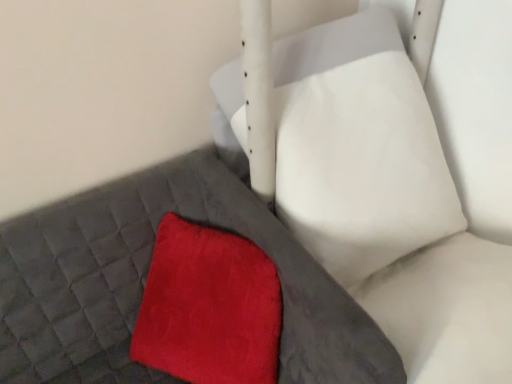
Question: Considering the relative sizes of velvety red throw pillow at center and matte gray bed frame at lower left in the image provided, is velvety red throw pillow at center bigger than matte gray bed frame at lower left?

Choices:
 (A) no
 (B) yes

Answer: (A)

Question: Could you tell me if velvety red throw pillow at center is turned towards matte gray bed frame at lower left?

Choices:
 (A) no
 (B) yes

Answer: (B)

Question: Can you confirm if velvety red throw pillow at center is taller than matte gray bed frame at lower left?

Choices:
 (A) yes
 (B) no

Answer: (B)

Question: Does velvety red throw pillow at center come behind matte gray bed frame at lower left?

Choices:
 (A) yes
 (B) no

Answer: (A)

Question: Does velvety red throw pillow at center have a greater width compared to matte gray bed frame at lower left?

Choices:
 (A) yes
 (B) no

Answer: (B)

Question: Is velvety red throw pillow at center in contact with matte gray bed frame at lower left?

Choices:
 (A) no
 (B) yes

Answer: (A)

Question: Is velvet red cushion at center located outside matte gray bed frame at lower left?

Choices:
 (A) no
 (B) yes

Answer: (B)

Question: Does velvet red cushion at center contain matte gray bed frame at lower left?

Choices:
 (A) yes
 (B) no

Answer: (B)

Question: Is velvet red cushion at center further to the viewer compared to matte gray bed frame at lower left?

Choices:
 (A) no
 (B) yes

Answer: (A)

Question: From the image's perspective, is velvet red cushion at center located beneath matte gray bed frame at lower left?

Choices:
 (A) no
 (B) yes

Answer: (A)

Question: Considering the relative sizes of velvet red cushion at center and matte gray bed frame at lower left in the image provided, is velvet red cushion at center thinner than matte gray bed frame at lower left?

Choices:
 (A) yes
 (B) no

Answer: (B)

Question: Is velvet red cushion at center aimed at matte gray bed frame at lower left?

Choices:
 (A) no
 (B) yes

Answer: (A)

Question: Is velvety red throw pillow at center wider than velvet red cushion at center?

Choices:
 (A) no
 (B) yes

Answer: (A)